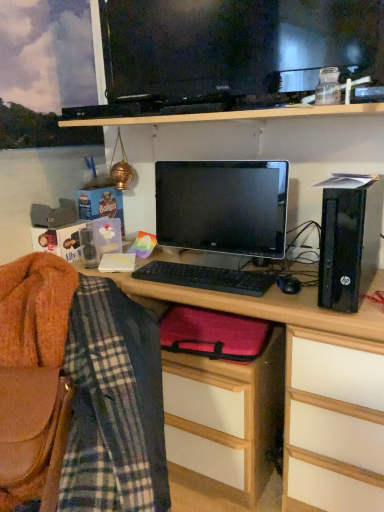
Locate an element on the screen. blank space situated above black matte keyboard at center (from a real-world perspective) is located at coordinates (210, 270).